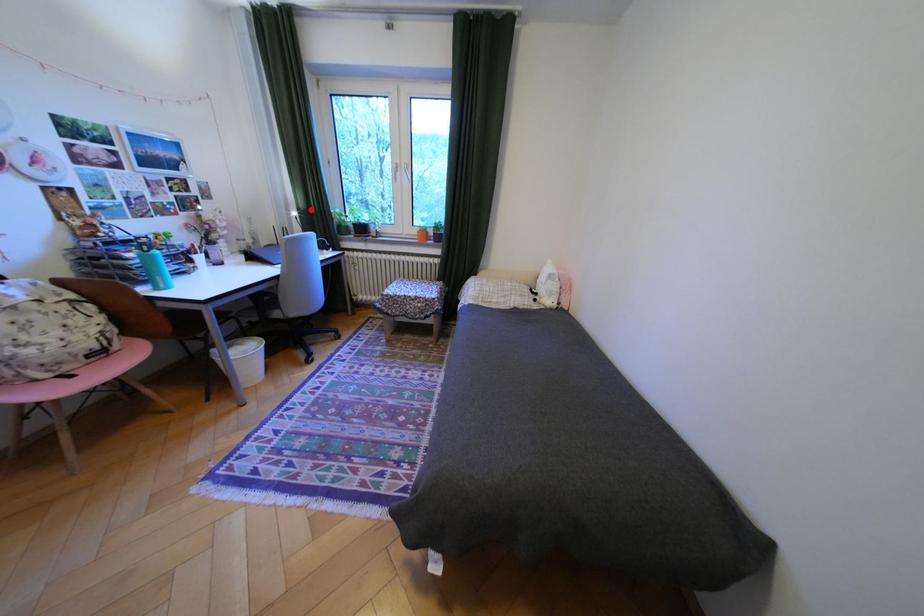
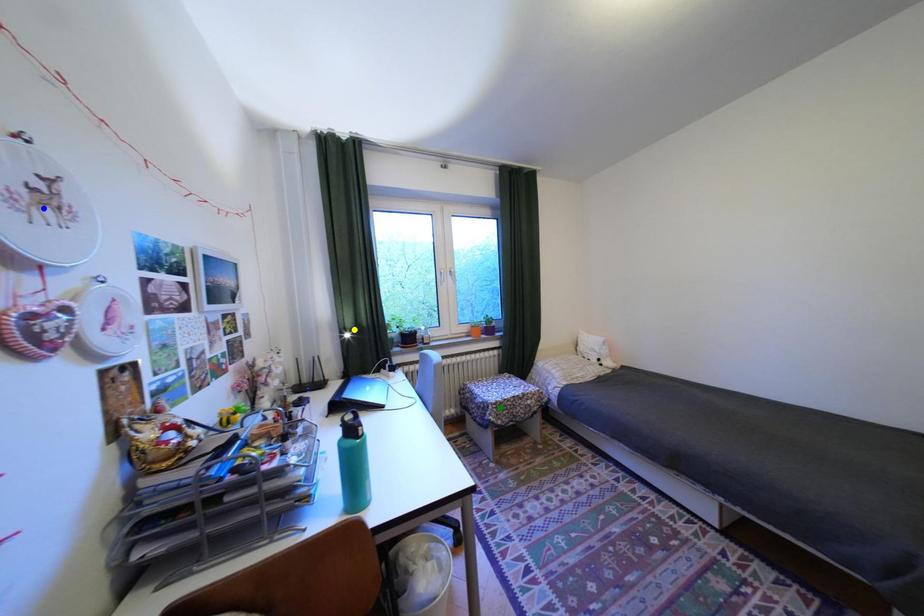
Question: I am providing you with two images of the same scene from different viewpoints. A red point is marked on the first image. You are given multiple points on the second image. Which mark in image 2 goes with the point in image 1?

Choices:
 (A) green point
 (B) blue point
 (C) yellow point

Answer: (C)